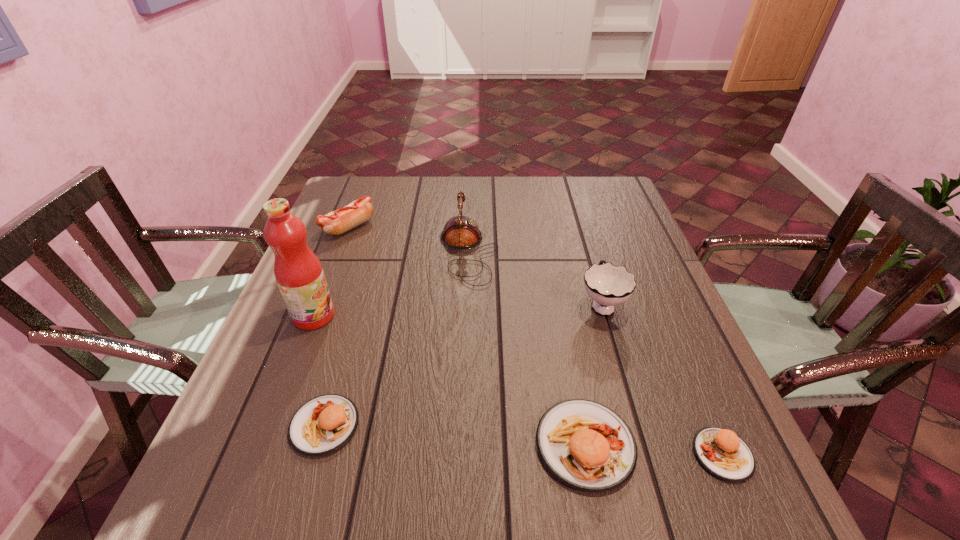
Image resolution: width=960 pixels, height=540 pixels. What are the coordinates of `free space between the sausage and the rightmost patty` in the screenshot? It's located at [536, 341].

Find the location of `vacant area that lies between the cup and the shortest object`. vacant area that lies between the cup and the shortest object is located at coordinates (662, 379).

Image resolution: width=960 pixels, height=540 pixels. In order to click on vacant region between the cup and the sixth shortest object in this screenshot , I will do `click(535, 278)`.

Locate an element on the screen. vacant point located between the tallest patty and the shortest patty is located at coordinates (654, 449).

Identify which object is located as the fifth nearest to the telephone. Please provide its 2D coordinates. Your answer should be formatted as a tuple, i.e. [(x, y)], where the tuple contains the x and y coordinates of a point satisfying the conditions above.

[(322, 425)]

This screenshot has width=960, height=540. I want to click on the fourth closest object to the fruit juice, so click(586, 445).

You are a GUI agent. You are given a task and a screenshot of the screen. Output one action in this format:
    pyautogui.click(x=<x>, y=<y>)
    Task: Click on the second closest patty to the tallest object
    Image resolution: width=960 pixels, height=540 pixels.
    Given the screenshot: What is the action you would take?
    pyautogui.click(x=586, y=445)

This screenshot has width=960, height=540. I want to click on the closest patty to the tallest object, so click(x=322, y=425).

Locate an element on the screen. The width and height of the screenshot is (960, 540). vacant position in the image that satisfies the following two spatial constraints: 1. on the rotary dial of the telephone; 2. on the side of the cup with the handle is located at coordinates (467, 303).

The image size is (960, 540). Find the location of `vacant position in the image that satisfies the following two spatial constraints: 1. on the front side of the shortest patty; 2. on the left side of the sausage`. vacant position in the image that satisfies the following two spatial constraints: 1. on the front side of the shortest patty; 2. on the left side of the sausage is located at coordinates (261, 455).